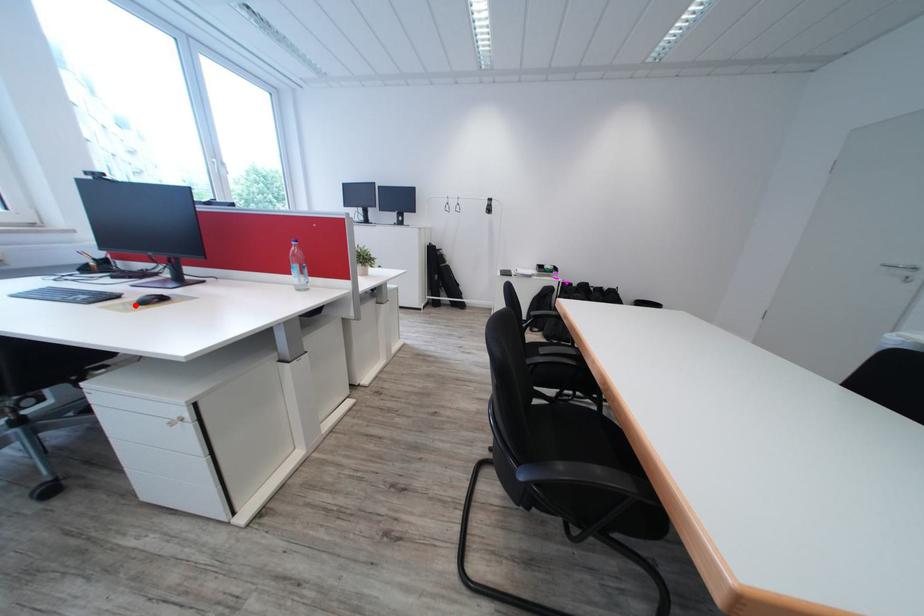
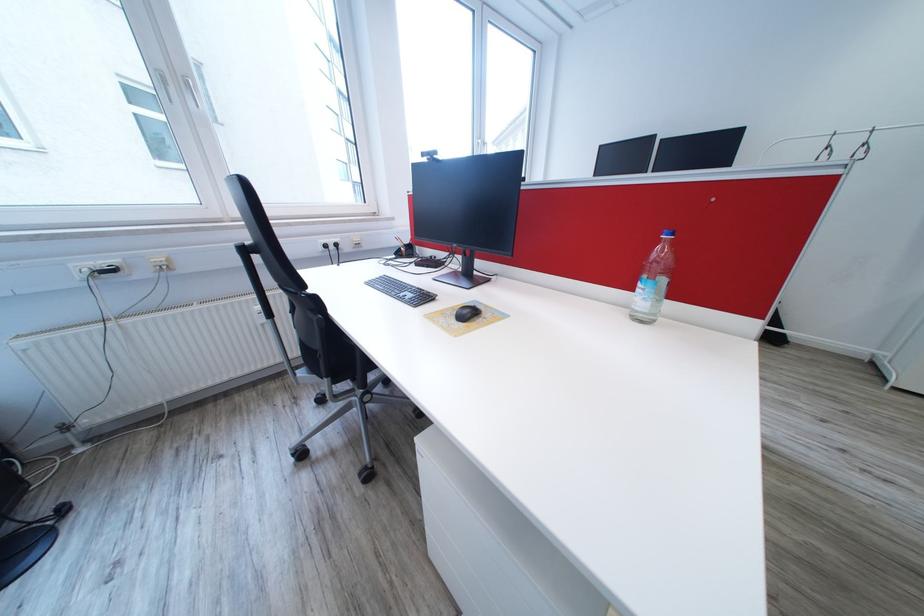
The point at the highlighted location is marked in the first image. Where is the corresponding point in the second image?

(454, 315)